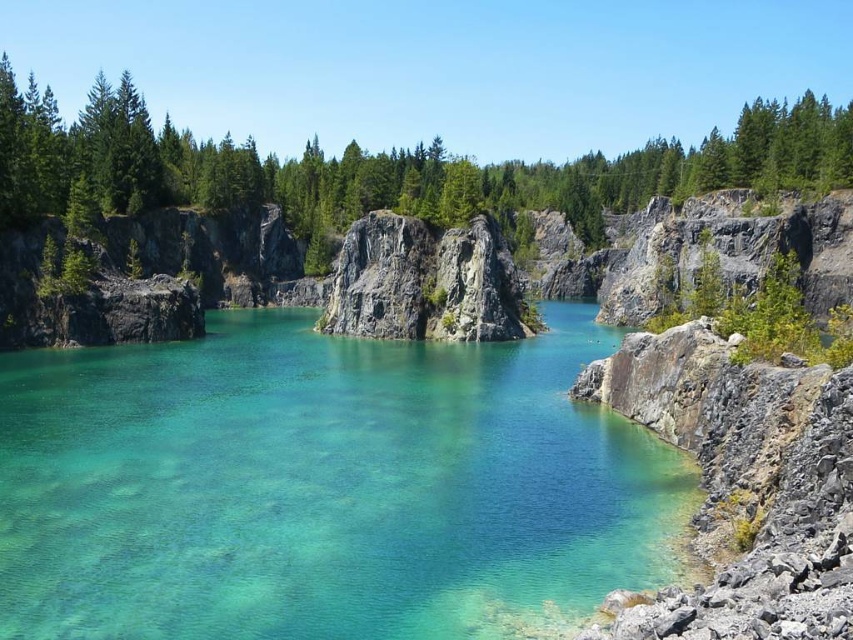
Question: Is green matte rock at center above rough granite rock at center?

Choices:
 (A) no
 (B) yes

Answer: (B)

Question: Considering the relative positions of green matte rock at center and rough granite rock at center in the image provided, where is green matte rock at center located with respect to rough granite rock at center?

Choices:
 (A) right
 (B) left

Answer: (B)

Question: Which object appears farthest from the camera in this image?

Choices:
 (A) rough granite rock at center
 (B) green matte rock at center
 (C) clear glassy water at center

Answer: (A)

Question: Observing the image, what is the correct spatial positioning of clear glassy water at center in reference to rough granite rock at center?

Choices:
 (A) right
 (B) left

Answer: (B)

Question: Which point is closer to the camera taking this photo?

Choices:
 (A) (495, 308)
 (B) (213, 170)

Answer: (A)

Question: Among these objects, which one is farthest from the camera?

Choices:
 (A) rough granite rock at center
 (B) green matte rock at center
 (C) clear glassy water at center

Answer: (A)